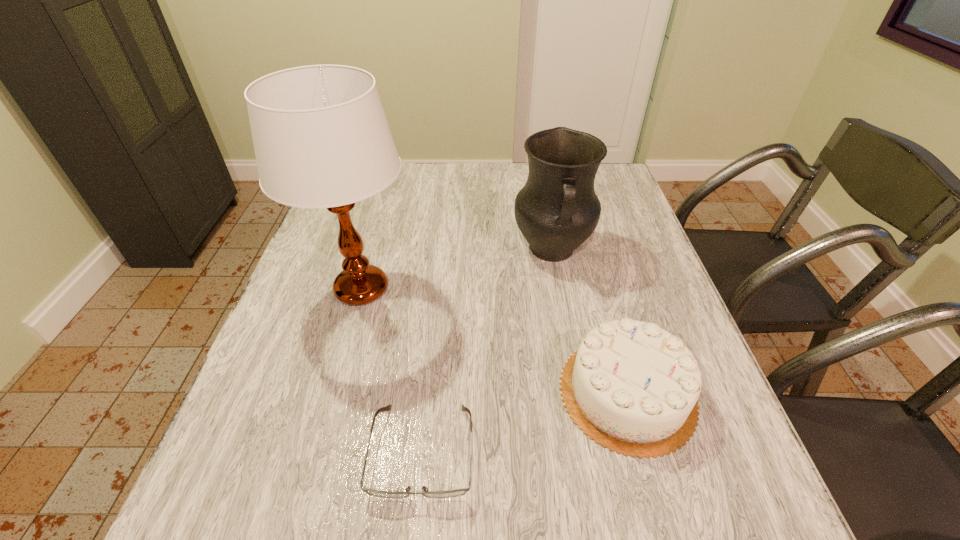
Where is `birthday cake that is at the right edge`? Image resolution: width=960 pixels, height=540 pixels. birthday cake that is at the right edge is located at coordinates (633, 387).

Find the location of a particular element. The height and width of the screenshot is (540, 960). free space at the far edge is located at coordinates (414, 180).

This screenshot has height=540, width=960. In the image, there is a desktop. What are the coordinates of `vacant space at the near edge` in the screenshot? It's located at (593, 509).

Find the location of `vacant region at the left edge of the desktop`. vacant region at the left edge of the desktop is located at coordinates (304, 390).

At what (x,y) coordinates should I click in order to perform the action: click on vacant area at the right edge. Please return your answer as a coordinate pair (x, y). This screenshot has height=540, width=960. Looking at the image, I should click on (722, 435).

In the image, there is a desktop. At what (x,y) coordinates should I click in order to perform the action: click on blank space at the near right corner. Please return your answer as a coordinate pair (x, y). This screenshot has height=540, width=960. Looking at the image, I should click on (758, 489).

What are the coordinates of `blank region between the birthday cake and the spectacles` in the screenshot? It's located at (525, 422).

Identify the location of empty space that is in between the third tallest object and the shortest object. (525, 422).

Where is `free space between the second tallest object and the table lamp`? This screenshot has width=960, height=540. free space between the second tallest object and the table lamp is located at coordinates (457, 269).

Identify the location of vacant area between the shortest object and the third tallest object. (525, 422).